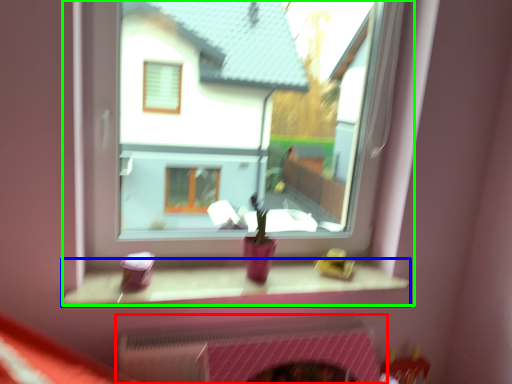
Question: Which object is positioned farthest from fireplace (highlighted by a red box)? Select from window sill (highlighted by a blue box) and window (highlighted by a green box).

Choices:
 (A) window sill
 (B) window

Answer: (B)